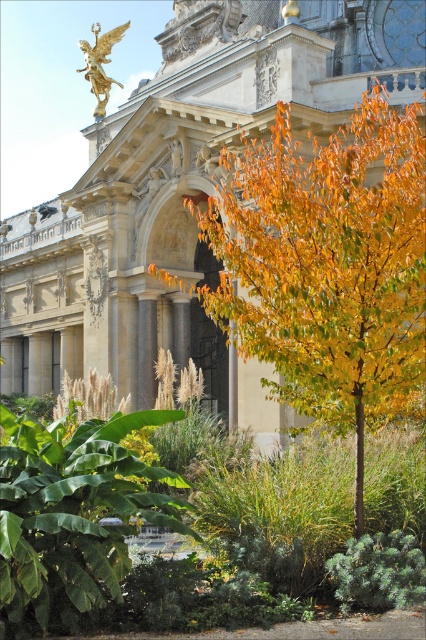
Does beige stone palace at center appear on the right side of gold polished statue at upper center?

Indeed, beige stone palace at center is positioned on the right side of gold polished statue at upper center.

Is beige stone palace at center positioned in front of gold polished statue at upper center?

Yes, it is in front of gold polished statue at upper center.

Identify the location of beige stone palace at center. The width and height of the screenshot is (426, 640). (184, 193).

Where is `beige stone palace at center`? The height and width of the screenshot is (640, 426). beige stone palace at center is located at coordinates (184, 193).

In the scene shown: Does beige stone palace at center have a lesser height compared to golden yellow leaves at center?

No.

I want to click on beige stone palace at center, so click(x=184, y=193).

What are the coordinates of `beige stone palace at center` in the screenshot? It's located at (184, 193).

Is golden yellow leaves at center to the right of gold polished statue at upper center from the viewer's perspective?

Correct, you'll find golden yellow leaves at center to the right of gold polished statue at upper center.

Which is in front, point (397, 321) or point (97, 49)?

Point (397, 321)

I want to click on golden yellow leaves at center, so click(x=325, y=266).